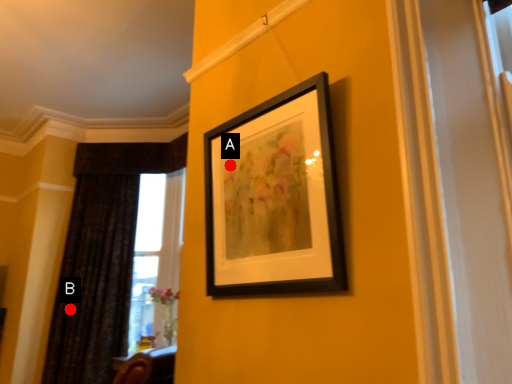
Question: Two points are circled on the image, labeled by A and B beside each circle. Which point is farther to the camera?

Choices:
 (A) A is further
 (B) B is further

Answer: (B)